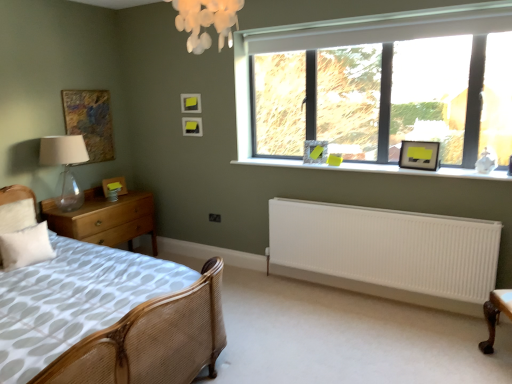
Identify the location of vacant area that is in front of white ribbed radiator at lower center. This screenshot has height=384, width=512. (372, 339).